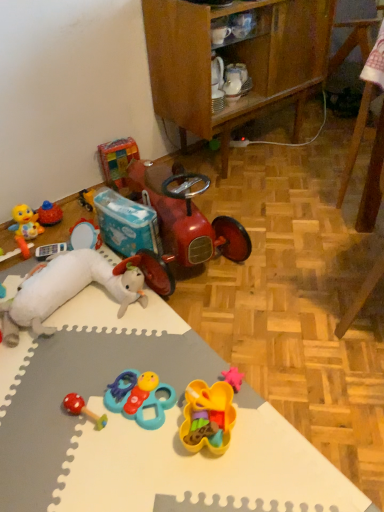
Describe the element at coordinates (67, 291) in the screenshot. I see `white plush toy at lower left, the 2th toy from the top` at that location.

In order to face white foam mat at lower left, should I rotate leftwards or rightwards?

Rotate left and turn 12.207 degrees.

What do you see at coordinates (141, 428) in the screenshot? This screenshot has height=512, width=384. I see `white foam mat at lower left` at bounding box center [141, 428].

The height and width of the screenshot is (512, 384). What do you see at coordinates (82, 409) in the screenshot?
I see `rubberized red mushroom rattle at lower left, the 5th toy viewed from the top` at bounding box center [82, 409].

I want to click on translucent plastic toy at center, which ranks as the second toy in bottom-to-top order, so [x=208, y=417].

This screenshot has width=384, height=512. What are the coordinates of `teal plastic toy at center, the third toy in the bottom-to-top sequence` in the screenshot? It's located at (140, 397).

In the scene shown: Which of these two, white foam mat at lower left or plastic colorful blocks at upper left, which ranks as the 5th toy in front-to-back order, is smaller?

plastic colorful blocks at upper left, which ranks as the 5th toy in front-to-back order.

Based on the photo, are white foam mat at lower left and plastic colorful blocks at upper left, which appears as the first toy when viewed from the top, located far from each other?

No, white foam mat at lower left is not far away from plastic colorful blocks at upper left, which appears as the first toy when viewed from the top.

How much distance is there between white foam mat at lower left and plastic colorful blocks at upper left, which ranks as the 5th toy in front-to-back order?

They are 36.96 inches apart.

Which is in front, white foam mat at lower left or plastic colorful blocks at upper left, which is the first toy from back to front?

white foam mat at lower left is closer to the camera.

From a real-world perspective, is white plush toy at lower left, the 2th toy from the top, above or below translucent plastic toy at center, which is the first toy in front-to-back order?

white plush toy at lower left, the 2th toy from the top, is above translucent plastic toy at center, which is the first toy in front-to-back order.

From the image's perspective, is white plush toy at lower left, positioned as the 4th toy in bottom-to-top order, beneath translucent plastic toy at center, the fifth toy from the back?

Actually, white plush toy at lower left, positioned as the 4th toy in bottom-to-top order, appears above translucent plastic toy at center, the fifth toy from the back, in the image.

Who is taller, white plush toy at lower left, which is the 4th toy in front-to-back order, or translucent plastic toy at center, which is the first toy in front-to-back order?

Standing taller between the two is white plush toy at lower left, which is the 4th toy in front-to-back order.

Is white plush toy at lower left, which is the 4th toy in front-to-back order, bigger or smaller than translucent plastic toy at center, which is the 4th toy in top-to-bottom order?

In the image, white plush toy at lower left, which is the 4th toy in front-to-back order, appears to be larger than translucent plastic toy at center, which is the 4th toy in top-to-bottom order.

In the image, is shiny red toy car at center positioned in front of or behind wooden cabinet at center?

shiny red toy car at center is positioned closer to the viewer than wooden cabinet at center.

Which of these two, shiny red toy car at center or wooden cabinet at center, stands shorter?

Standing shorter between the two is shiny red toy car at center.

Is point (113, 181) farther from viewer compared to point (170, 68)?

Yes, point (113, 181) is behind point (170, 68).

Is wooden cabinet at center positioned in front of shiny red toy car at center?

No, wooden cabinet at center is further to the viewer.

Is wooden cabinet at center not close to shiny red toy car at center?

Actually, wooden cabinet at center and shiny red toy car at center are a little close together.

From the image's perspective, is wooden cabinet at center located above or below shiny red toy car at center?

From the image's perspective, wooden cabinet at center appears above shiny red toy car at center.

Choose the correct answer: Is wooden cabinet at center inside shiny red toy car at center or outside it?

wooden cabinet at center lies outside shiny red toy car at center.

Which is in front, point (188, 14) or point (125, 156)?

Positioned in front is point (188, 14).

Is wooden cabinet at center not near plastic colorful blocks at upper left, which is the first toy from back to front?

No.

Where is `cabinetry located on the right of plastic colorful blocks at upper left, which is counted as the fifth toy, starting from the bottom`? The width and height of the screenshot is (384, 512). cabinetry located on the right of plastic colorful blocks at upper left, which is counted as the fifth toy, starting from the bottom is located at coordinates (235, 60).

Can you tell me how much wooden cabinet at center and plastic colorful blocks at upper left, which ranks as the 5th toy in front-to-back order, differ in facing direction?

The angle between the facing direction of wooden cabinet at center and the facing direction of plastic colorful blocks at upper left, which ranks as the 5th toy in front-to-back order, is 13.4 degrees.

Would you consider plastic colorful blocks at upper left, which is counted as the fifth toy, starting from the bottom, to be distant from shiny red toy car at center?

plastic colorful blocks at upper left, which is counted as the fifth toy, starting from the bottom, is near shiny red toy car at center, not far away.

From a real-world perspective, between plastic colorful blocks at upper left, which is counted as the fifth toy, starting from the bottom, and shiny red toy car at center, who is vertically lower?

From a 3D spatial view, plastic colorful blocks at upper left, which is counted as the fifth toy, starting from the bottom, is below.

From the image's perspective, which one is positioned lower, plastic colorful blocks at upper left, which ranks as the 5th toy in front-to-back order, or shiny red toy car at center?

shiny red toy car at center appears lower in the image.

Is plastic colorful blocks at upper left, which is counted as the fifth toy, starting from the bottom, at the right side of shiny red toy car at center?

No, plastic colorful blocks at upper left, which is counted as the fifth toy, starting from the bottom, is not to the right of shiny red toy car at center.

At what (x,y) coordinates should I click in order to perform the action: click on toy that is the 4th object located above the rubberized red mushroom rattle at lower left, the fourth toy when ordered from back to front (from the image's perspective). Please return your answer as a coordinate pair (x, y). This screenshot has height=512, width=384. Looking at the image, I should click on (117, 160).

Does rubberized red mushroom rattle at lower left, arranged as the first toy when ordered from the bottom, have a lesser width compared to plastic colorful blocks at upper left, which ranks as the 5th toy in front-to-back order?

No, rubberized red mushroom rattle at lower left, arranged as the first toy when ordered from the bottom, is not thinner than plastic colorful blocks at upper left, which ranks as the 5th toy in front-to-back order.

Would you say rubberized red mushroom rattle at lower left, the 2th toy in the front-to-back sequence, is to the left or to the right of plastic colorful blocks at upper left, which ranks as the 5th toy in front-to-back order, in the picture?

From the image, it's evident that rubberized red mushroom rattle at lower left, the 2th toy in the front-to-back sequence, is to the right of plastic colorful blocks at upper left, which ranks as the 5th toy in front-to-back order.

How far apart are rubberized red mushroom rattle at lower left, the fourth toy when ordered from back to front, and plastic colorful blocks at upper left, which is the first toy from back to front?

A distance of 1.14 meters exists between rubberized red mushroom rattle at lower left, the fourth toy when ordered from back to front, and plastic colorful blocks at upper left, which is the first toy from back to front.

Identify the location of desk in front of the plastic colorful blocks at upper left, which is counted as the fifth toy, starting from the bottom. The height and width of the screenshot is (512, 384). (141, 428).

The image size is (384, 512). There is a translucent plastic toy at center, the fifth toy from the back. Find the location of `the 2nd toy above it (from the image's perspective)`. the 2nd toy above it (from the image's perspective) is located at coordinates (67, 291).

From the image, which object appears to be nearer to rubberized red mushroom rattle at lower left, the fourth toy when ordered from back to front, white foam mat at lower left or wooden cabinet at center?

Among the two, white foam mat at lower left is located nearer to rubberized red mushroom rattle at lower left, the fourth toy when ordered from back to front.

Based on their spatial positions, is white foam mat at lower left or teal plastic toy at center, the third toy in the bottom-to-top sequence, closer to shiny red toy car at center?

white foam mat at lower left is closer to shiny red toy car at center.

When comparing their distances from white plush toy at lower left, which is the 4th toy in front-to-back order, does translucent plastic toy at center, the fifth toy from the back, or shiny red toy car at center seem further?

translucent plastic toy at center, the fifth toy from the back, is positioned further to the anchor white plush toy at lower left, which is the 4th toy in front-to-back order.

Which object lies nearer to the anchor point wooden cabinet at center, white plush toy at lower left, which is the 4th toy in front-to-back order, or plastic colorful blocks at upper left, which appears as the first toy when viewed from the top?

The object closer to wooden cabinet at center is plastic colorful blocks at upper left, which appears as the first toy when viewed from the top.

Looking at the image, which one is located closer to white plush toy at lower left, positioned as the 4th toy in bottom-to-top order, shiny red toy car at center or teal plastic toy at center, which is counted as the 3th toy, starting from the front?

Based on the image, shiny red toy car at center appears to be nearer to white plush toy at lower left, positioned as the 4th toy in bottom-to-top order.

Based on their spatial positions, is white foam mat at lower left or wooden cabinet at center closer to teal plastic toy at center, which ranks as the 3th toy in top-to-bottom order?

white foam mat at lower left.

Looking at the image, which one is located closer to shiny red toy car at center, wooden cabinet at center or plastic colorful blocks at upper left, which ranks as the 5th toy in front-to-back order?

Based on the image, plastic colorful blocks at upper left, which ranks as the 5th toy in front-to-back order, appears to be nearer to shiny red toy car at center.

Consider the image. Looking at the image, which one is located further to rubberized red mushroom rattle at lower left, the fourth toy when ordered from back to front, white plush toy at lower left, positioned as the 2th toy in back-to-front order, or shiny red toy car at center?

Based on the image, shiny red toy car at center appears to be further to rubberized red mushroom rattle at lower left, the fourth toy when ordered from back to front.

I want to click on toy car between wooden cabinet at center and white foam mat at lower left in the vertical direction, so click(181, 223).

Where is `toy car between wooden cabinet at center and translucent plastic toy at center, the fifth toy from the back, in the up-down direction`? This screenshot has width=384, height=512. toy car between wooden cabinet at center and translucent plastic toy at center, the fifth toy from the back, in the up-down direction is located at coordinates (181, 223).

In order to click on toy car between white plush toy at lower left, which is the 4th toy in front-to-back order, and plastic colorful blocks at upper left, which appears as the first toy when viewed from the top, in the front-back direction in this screenshot , I will do `click(181, 223)`.

You are a GUI agent. You are given a task and a screenshot of the screen. Output one action in this format:
    pyautogui.click(x=<x>, y=<y>)
    Task: Click on the toy that lies between wooden cabinet at center and white plush toy at lower left, which is the 4th toy in front-to-back order, from top to bottom
    The width and height of the screenshot is (384, 512).
    Given the screenshot: What is the action you would take?
    pyautogui.click(x=117, y=160)